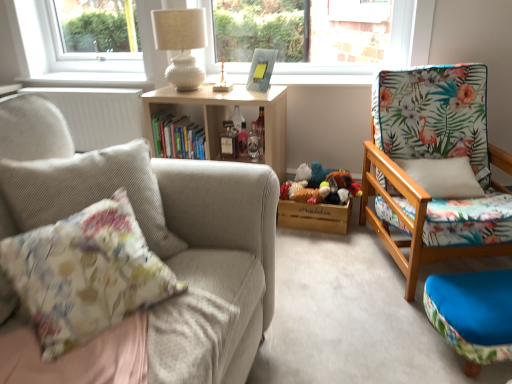
Image resolution: width=512 pixels, height=384 pixels. Find the location of `white ribbed radiator at left`. white ribbed radiator at left is located at coordinates (97, 114).

In order to face clear glass bottle at center, which is the 3th bottle in left-to-right order, should I rotate leftwards or rightwards?

Turn left approximately 0.286 degrees to face it.

Find the location of a particular element. This screenshot has height=384, width=512. textured beige sofa at left, the 1th chair viewed from the left is located at coordinates (156, 223).

This screenshot has width=512, height=384. Describe the element at coordinates (237, 118) in the screenshot. I see `translucent glass bottle at center, which is the second bottle from right to left` at that location.

You are a GUI agent. You are given a task and a screenshot of the screen. Output one action in this format:
    pyautogui.click(x=<x>, y=<y>)
    Task: Click on the blue fabric ottoman at lower right
    
    Given the screenshot: What is the action you would take?
    pyautogui.click(x=473, y=314)

I want to click on translucent glass figurine at upper center, so click(223, 81).

Where is `floral fabric chair at right, placed as the 1th chair when sorted from right to left`? This screenshot has width=512, height=384. floral fabric chair at right, placed as the 1th chair when sorted from right to left is located at coordinates pos(433,158).

Who is bigger, floral fabric cushion at left or translucent glass figurine at upper center?

floral fabric cushion at left is bigger.

Is floral fabric cushion at left directly adjacent to translucent glass figurine at upper center?

No, floral fabric cushion at left is not beside translucent glass figurine at upper center.

Is translucent glass figurine at upper center located within floral fabric cushion at left?

Actually, translucent glass figurine at upper center is outside floral fabric cushion at left.

Is floral fabric cushion at left wider than translucent glass figurine at upper center?

Correct, the width of floral fabric cushion at left exceeds that of translucent glass figurine at upper center.

How distant is textured beige sofa at left, the 1th chair viewed from the left, from floral fabric chair at right, which is the 1th chair from back to front?

textured beige sofa at left, the 1th chair viewed from the left, and floral fabric chair at right, which is the 1th chair from back to front, are 1.02 meters apart.

Between textured beige sofa at left, the 1th chair viewed from the left, and floral fabric chair at right, which is the 2th chair in front-to-back order, which one has larger size?

Bigger between the two is floral fabric chair at right, which is the 2th chair in front-to-back order.

In the scene shown: From a real-world perspective, which object rests below the other?

floral fabric chair at right, which is the 2th chair in front-to-back order, from a real-world perspective.

The width and height of the screenshot is (512, 384). Identify the location of chair above the floral fabric chair at right, which is the 1th chair from back to front (from a real-world perspective). (156, 223).

Which object is further away from the camera taking this photo, translucent glass bottle at center, which is the second bottle from right to left, or white ribbed radiator at left?

white ribbed radiator at left.

Considering the relative sizes of translucent glass bottle at center, acting as the second bottle starting from the left, and white ribbed radiator at left in the image provided, is translucent glass bottle at center, acting as the second bottle starting from the left, taller than white ribbed radiator at left?

Incorrect, the height of translucent glass bottle at center, acting as the second bottle starting from the left, is not larger of that of white ribbed radiator at left.

Consider the image. Which of these two, translucent glass bottle at center, acting as the second bottle starting from the left, or white ribbed radiator at left, is bigger?

white ribbed radiator at left.

Is translucent glass bottle at center, which is the second bottle from right to left, not near white ribbed radiator at left?

translucent glass bottle at center, which is the second bottle from right to left, is actually quite close to white ribbed radiator at left.

Would you say floral fabric cushion at left is to the left or to the right of wooden bookshelf at center in the picture?

floral fabric cushion at left is positioned on wooden bookshelf at center's left side.

Which is nearer, (8, 256) or (281, 180)?

Point (8, 256)

In the scene shown: Could you tell me if floral fabric cushion at left is facing wooden bookshelf at center?

No, floral fabric cushion at left is not aimed at wooden bookshelf at center.

Is translucent glass figurine at upper center wider or thinner than white textured lamp at upper center?

translucent glass figurine at upper center is thinner than white textured lamp at upper center.

Consider the image. Is translucent glass figurine at upper center in front of white textured lamp at upper center?

That is False.

From a real-world perspective, is translucent glass figurine at upper center positioned under white textured lamp at upper center based on gravity?

Yes, from a real-world perspective, translucent glass figurine at upper center is under white textured lamp at upper center.

From the image's perspective, would you say translucent glass figurine at upper center is shown under white textured lamp at upper center?

Yes, from the image's perspective, translucent glass figurine at upper center is beneath white textured lamp at upper center.

Does textured beige sofa at left, the second chair from the back, have a lesser height compared to wooden bookshelf at center?

No, textured beige sofa at left, the second chair from the back, is not shorter than wooden bookshelf at center.

Can you confirm if textured beige sofa at left, positioned as the second chair in right-to-left order, is thinner than wooden bookshelf at center?

No.

Is textured beige sofa at left, acting as the first chair starting from the front, aimed at wooden bookshelf at center?

No.

You are a GUI agent. You are given a task and a screenshot of the screen. Output one action in this format:
    pyautogui.click(x=<x>, y=<y>)
    Task: Click on the shelf located above the textured beige sofa at left, the second chair from the back (from the image's perspective)
    The width and height of the screenshot is (512, 384).
    Given the screenshot: What is the action you would take?
    pyautogui.click(x=226, y=115)

Is blue fabric ottoman at lower right not near translucent glass figurine at upper center?

Yes, blue fabric ottoman at lower right and translucent glass figurine at upper center are quite far apart.

The height and width of the screenshot is (384, 512). I want to click on toy above the blue fabric ottoman at lower right (from the image's perspective), so click(x=223, y=81).

Between blue fabric ottoman at lower right and translucent glass figurine at upper center, which one has larger size?

blue fabric ottoman at lower right is bigger.

Locate an element on the screen. pillow below the translucent glass figurine at upper center (from a real-world perspective) is located at coordinates (86, 273).

Locate an element on the screen. Image resolution: width=512 pixels, height=384 pixels. chair that appears on the right of textured beige sofa at left, the 1th chair viewed from the left is located at coordinates (433, 158).

When comparing their distances from white ribbed radiator at left, does wooden bookshelf at center or blue fabric ottoman at lower right seem closer?

wooden bookshelf at center lies closer to white ribbed radiator at left than the other object.

From the picture: Estimate the real-world distances between objects in this image. Which object is closer to floral fabric cushion at left, translucent glass bottle at center, which is the second bottle from right to left, or white textured lamp at upper center?

white textured lamp at upper center is closer to floral fabric cushion at left.

Estimate the real-world distances between objects in this image. Which object is closer to translucent glass bottle at center, which is the second bottle from right to left, white textured lamp at upper center or wooden bookshelf at center?

The object closer to translucent glass bottle at center, which is the second bottle from right to left, is wooden bookshelf at center.

Based on the photo, when comparing their distances from translucent glass figurine at upper center, does white ribbed radiator at left or floral fabric cushion at left seem closer?

Based on the image, white ribbed radiator at left appears to be nearer to translucent glass figurine at upper center.

When comparing their distances from textured beige sofa at left, acting as the first chair starting from the front, does blue fabric ottoman at lower right or wooden bookshelf at center seem closer?

Based on the image, blue fabric ottoman at lower right appears to be nearer to textured beige sofa at left, acting as the first chair starting from the front.

From the image, which object appears to be farther from floral fabric chair at right, which ranks as the 2th chair in left-to-right order, white ribbed radiator at left or textured beige sofa at left, the second chair from the back?

white ribbed radiator at left is further to floral fabric chair at right, which ranks as the 2th chair in left-to-right order.

From the image, which object appears to be farther from blue fabric ottoman at lower right, white ribbed radiator at left or floral fabric cushion at left?

Based on the image, white ribbed radiator at left appears to be further to blue fabric ottoman at lower right.

From the image, which object appears to be nearer to translucent glass bottle at center, acting as the second bottle starting from the left, clear glass bottle at center, which appears as the first bottle when viewed from the right, or floral fabric cushion at left?

Among the two, clear glass bottle at center, which appears as the first bottle when viewed from the right, is located nearer to translucent glass bottle at center, acting as the second bottle starting from the left.

This screenshot has width=512, height=384. Identify the location of toy that lies between white textured lamp at upper center and clear glass bottle at center, which is the 3th bottle in left-to-right order, from top to bottom. (223, 81).

At what (x,y) coordinates should I click in order to perform the action: click on toy between hardcover books at center and blue fabric ottoman at lower right. Please return your answer as a coordinate pair (x, y). Looking at the image, I should click on (223, 81).

Locate an element on the screen. This screenshot has width=512, height=384. bottle between translucent glass figurine at upper center and shiny glass bottle at center, which is the 3th bottle from right to left, from top to bottom is located at coordinates (237, 118).

Identify the location of chair between textured beige sofa at left, the 1th chair viewed from the left, and white ribbed radiator at left, along the z-axis. The width and height of the screenshot is (512, 384). (433, 158).